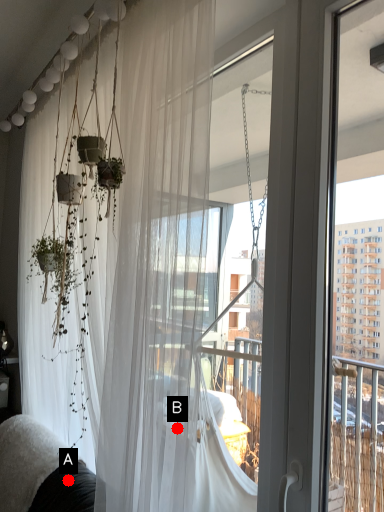
Question: Two points are circled on the image, labeled by A and B beside each circle. Which point is farther from the camera taking this photo?

Choices:
 (A) A is further
 (B) B is further

Answer: (A)